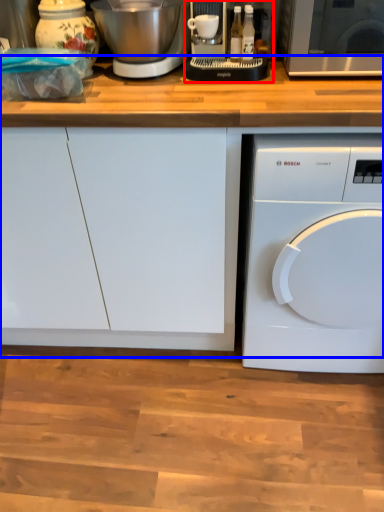
Question: Which object is further to the camera taking this photo, food processor (highlighted by a red box) or counter top (highlighted by a blue box)?

Choices:
 (A) food processor
 (B) counter top

Answer: (A)